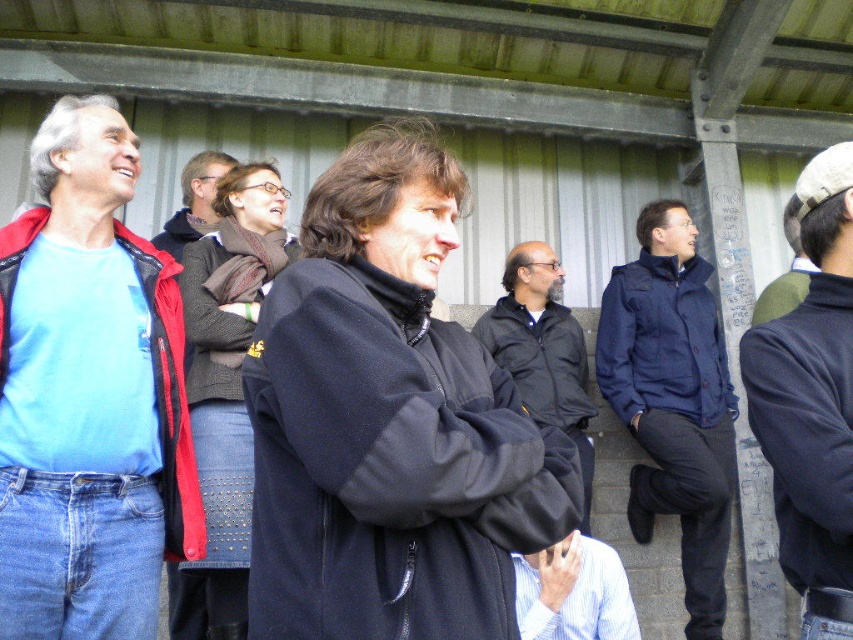
You are organizing a photo shoot and need to position two models wearing the knitted wool sweater at center and the matte black jacket at center. Based on the scene description, which model should stand to the left to maintain the original spatial arrangement?

The matte black jacket at center should stand to the left because the knitted wool sweater at center is to the right of it in the original scene.

You are organizing a clothing donation drive and need to categorize items by size. You have two items to sort, the knitted wool sweater at center and the dark blue fleece jacket at upper center. Which one should you place in the large size bin?

The knitted wool sweater at center should be placed in the large size bin because it has a larger size compared to the dark blue fleece jacket at upper center.

You are standing in the middle of the gathering and want to locate the knitted wool scarf at upper center. According to the coordinates provided, in which direction should you look to find it?

The knitted wool scarf at upper center is located at coordinates point [225,390], so you should look towards the upper center direction to find it.